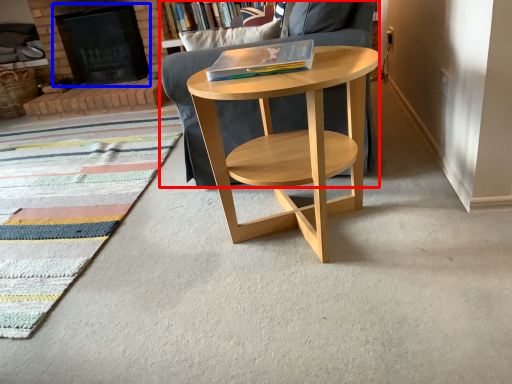
Question: Which object appears farthest to the camera in this image, chair (highlighted by a red box) or fireplace (highlighted by a blue box)?

Choices:
 (A) chair
 (B) fireplace

Answer: (B)